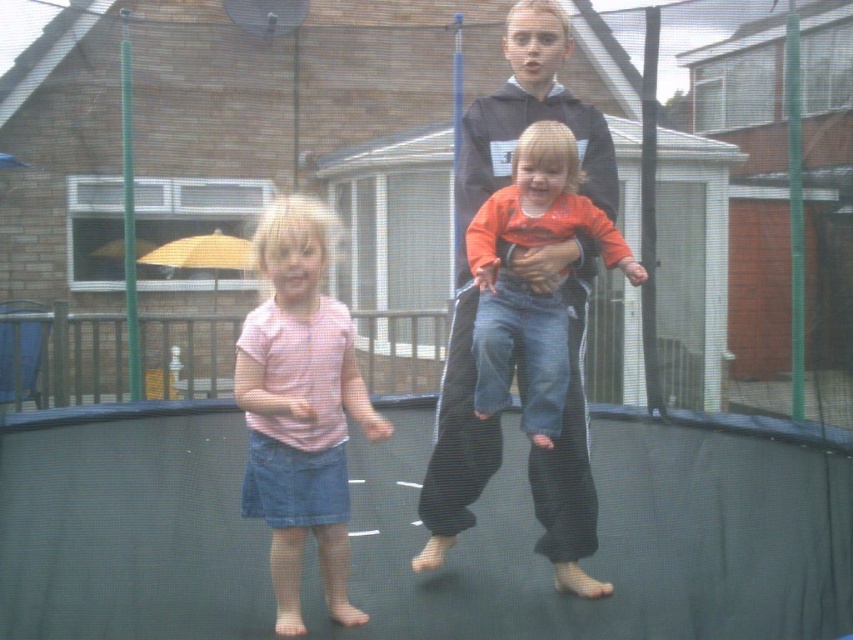
Based on the photo, between pink cotton shirt at center and orange cotton shirt at center, which one has less height?

Standing shorter between the two is orange cotton shirt at center.

Is pink cotton shirt at center wider than orange cotton shirt at center?

No, pink cotton shirt at center is not wider than orange cotton shirt at center.

What do you see at coordinates (300, 406) in the screenshot?
I see `pink cotton shirt at center` at bounding box center [300, 406].

Find the location of a particular element. The width and height of the screenshot is (853, 640). pink cotton shirt at center is located at coordinates (300, 406).

Is black hoodie at center further to the viewer compared to orange cotton shirt at center?

Yes, it is behind orange cotton shirt at center.

Identify the location of black hoodie at center. The width and height of the screenshot is (853, 640). (463, 253).

Who is positioned more to the left, black hoodie at center or pink cotton shirt at center?

Positioned to the left is pink cotton shirt at center.

Which is below, black hoodie at center or pink cotton shirt at center?

pink cotton shirt at center is lower down.

What do you see at coordinates (463, 253) in the screenshot? This screenshot has width=853, height=640. I see `black hoodie at center` at bounding box center [463, 253].

Locate an element on the screen. Image resolution: width=853 pixels, height=640 pixels. black hoodie at center is located at coordinates (463, 253).